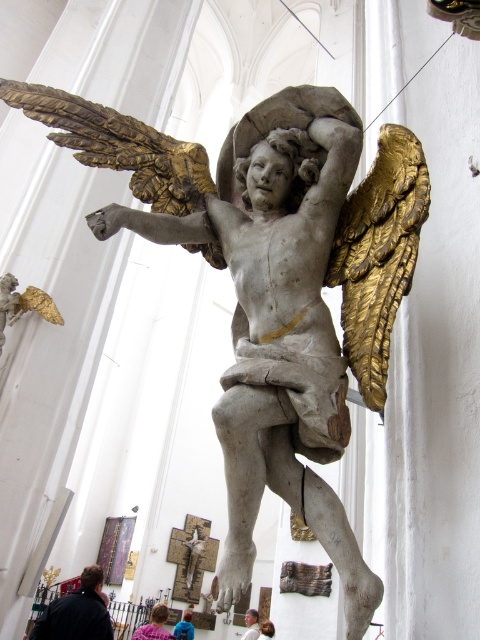
Consider the image. You are a visitor in this cathedral and you see the dark brown leather jacket at lower left and the blonde hair at lower center. Which object is positioned higher from the ground?

The dark brown leather jacket at lower left is located above blonde hair at lower center, so it is higher from the ground.

You are standing in the cathedral and see the blue fabric child at lower center and the blue denim jacket at lower center. Which one is nearer to you?

The blue fabric child at lower center is closer to you than the blue denim jacket at lower center.